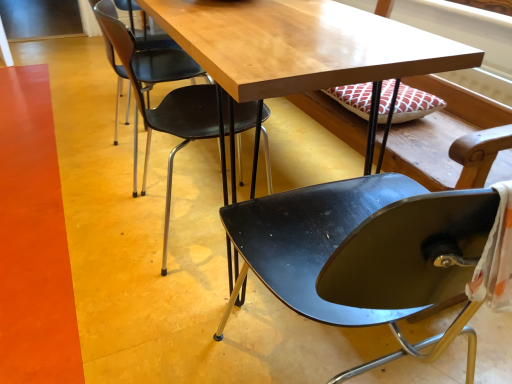
What are the coordinates of `vacant region in front of black plastic chair at upper center, acting as the 1th chair starting from the left` in the screenshot? It's located at (155, 300).